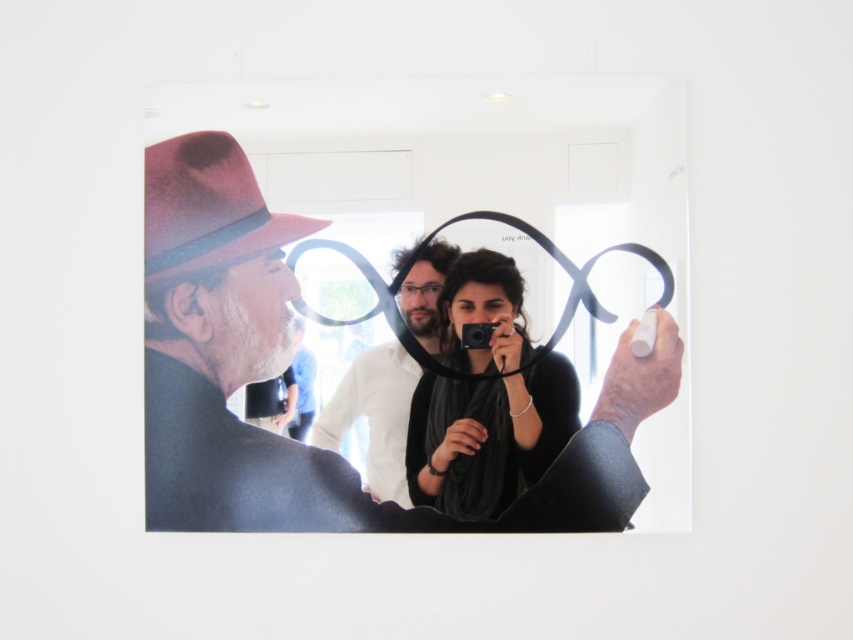
Between matte black suit at center and black plastic camera at center, which one is positioned lower?

Positioned lower is matte black suit at center.

Describe the element at coordinates (265, 376) in the screenshot. The height and width of the screenshot is (640, 853). I see `matte black suit at center` at that location.

Image resolution: width=853 pixels, height=640 pixels. I want to click on matte black suit at center, so click(265, 376).

Who is taller, matte black suit at center or matte black camera at center?

Standing taller between the two is matte black suit at center.

Can you confirm if matte black suit at center is positioned above matte black camera at center?

No.

Does point (189, 304) come farther from viewer compared to point (447, 275)?

That is False.

In order to click on matte black suit at center in this screenshot , I will do [x=265, y=376].

Is matte black camera at center wider than black plastic camera at center?

Yes, matte black camera at center is wider than black plastic camera at center.

Is matte black camera at center further to camera compared to black plastic camera at center?

No, matte black camera at center is in front of black plastic camera at center.

Is point (440, 298) farther from viewer compared to point (463, 337)?

Yes.

Where is `matte black camera at center`? matte black camera at center is located at coordinates (486, 436).